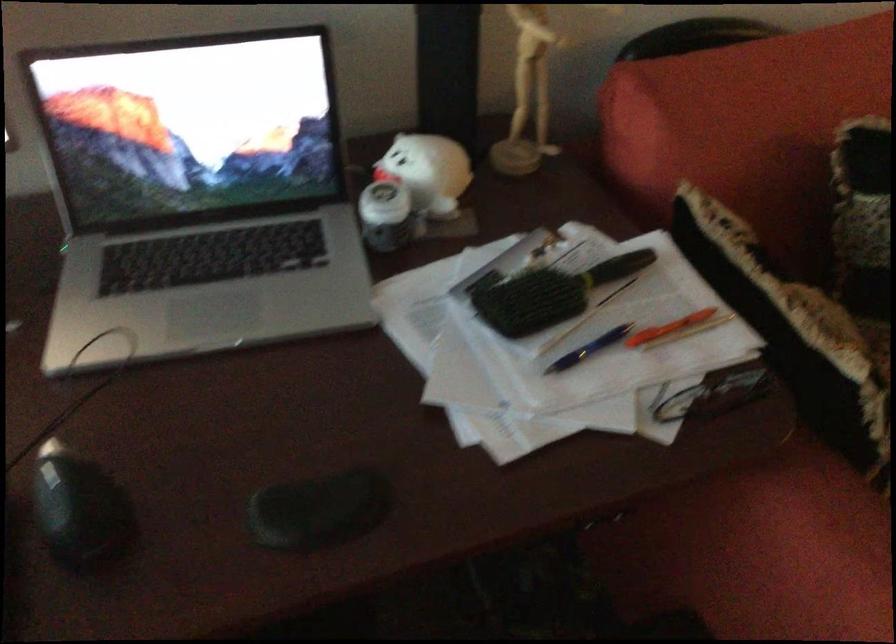
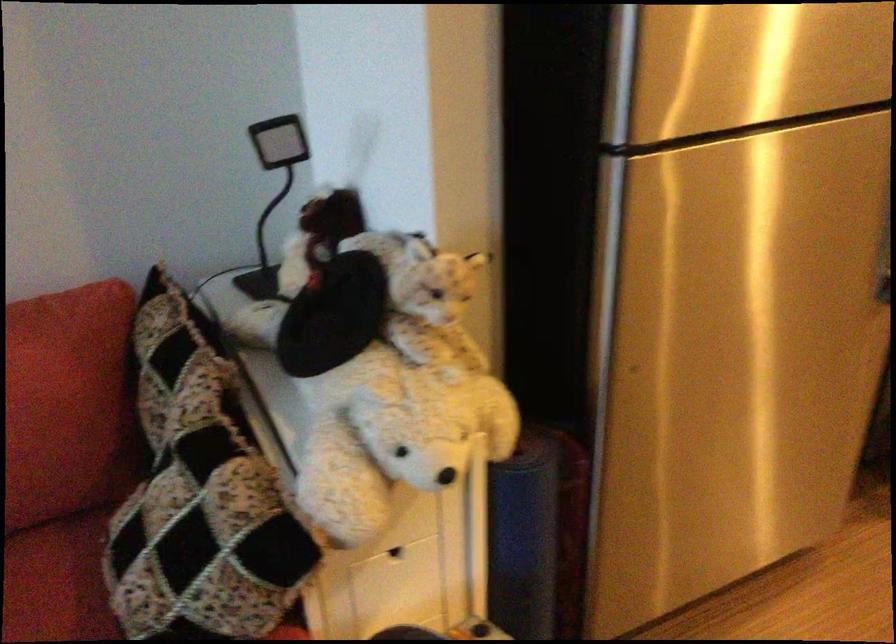
Question: Which direction would the cameraman need to move to produce the second image? Reply with the corresponding letter.

Choices:
 (A) Left
 (B) Right
 (C) Forward
 (D) Backward

Answer: (B)